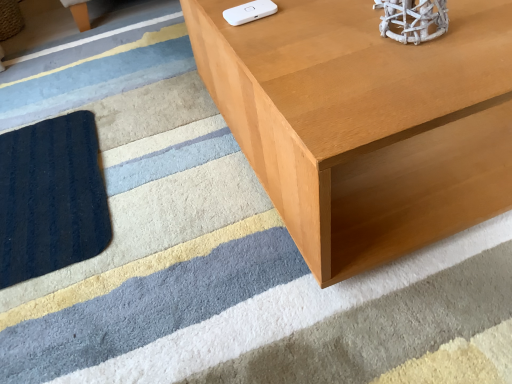
Question: From a real-world perspective, is light brown wood table at upper right positioned over white matte wii controller at upper center based on gravity?

Choices:
 (A) no
 (B) yes

Answer: (A)

Question: Can you confirm if light brown wood table at upper right is shorter than white matte wii controller at upper center?

Choices:
 (A) yes
 (B) no

Answer: (B)

Question: Would you say light brown wood table at upper right is a long distance from white matte wii controller at upper center?

Choices:
 (A) no
 (B) yes

Answer: (A)

Question: Is light brown wood table at upper right closer to the viewer compared to white matte wii controller at upper center?

Choices:
 (A) no
 (B) yes

Answer: (B)

Question: Does light brown wood table at upper right turn towards white matte wii controller at upper center?

Choices:
 (A) yes
 (B) no

Answer: (B)

Question: Is light brown wood table at upper right not within white matte wii controller at upper center?

Choices:
 (A) no
 (B) yes

Answer: (B)

Question: From the image's perspective, is white matte wii controller at upper center below light brown wood table at upper right?

Choices:
 (A) yes
 (B) no

Answer: (A)

Question: Does white matte wii controller at upper center lie behind light brown wood table at upper right?

Choices:
 (A) yes
 (B) no

Answer: (A)

Question: Is white matte wii controller at upper center turned away from light brown wood table at upper right?

Choices:
 (A) yes
 (B) no

Answer: (B)

Question: Considering the relative sizes of white matte wii controller at upper center and light brown wood table at upper right in the image provided, is white matte wii controller at upper center bigger than light brown wood table at upper right?

Choices:
 (A) yes
 (B) no

Answer: (B)

Question: Is white matte wii controller at upper center at the left side of light brown wood table at upper right?

Choices:
 (A) yes
 (B) no

Answer: (A)

Question: From the image's perspective, is white matte wii controller at upper center located above light brown wood table at upper right?

Choices:
 (A) yes
 (B) no

Answer: (B)

Question: Is point (267, 3) positioned closer to the camera than point (420, 223)?

Choices:
 (A) farther
 (B) closer

Answer: (A)